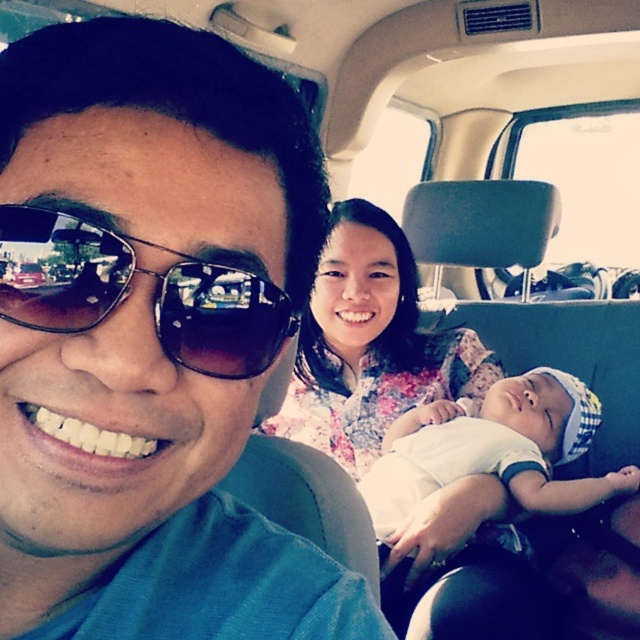
Which is behind, point (168, 218) or point (545, 499)?

Point (545, 499)

Does matte black sunglasses at left appear under white soft fabric baby at center?

No.

The height and width of the screenshot is (640, 640). What are the coordinates of `matte black sunglasses at left` in the screenshot? It's located at (150, 339).

Is matte black sunglasses at left to the left of floral fabric dress at center from the viewer's perspective?

Yes, matte black sunglasses at left is to the left of floral fabric dress at center.

Is the position of matte black sunglasses at left less distant than that of floral fabric dress at center?

Yes, matte black sunglasses at left is in front of floral fabric dress at center.

Is point (208, 276) more distant than point (348, 348)?

No, it is not.

Where is `matte black sunglasses at left`? Image resolution: width=640 pixels, height=640 pixels. matte black sunglasses at left is located at coordinates (150, 339).

Between floral fabric dress at center and sunglasses at left, which one has less height?

With less height is sunglasses at left.

Is floral fabric dress at center to the left of sunglasses at left from the viewer's perspective?

In fact, floral fabric dress at center is to the right of sunglasses at left.

Find the location of a particular element. The width and height of the screenshot is (640, 640). floral fabric dress at center is located at coordinates (371, 344).